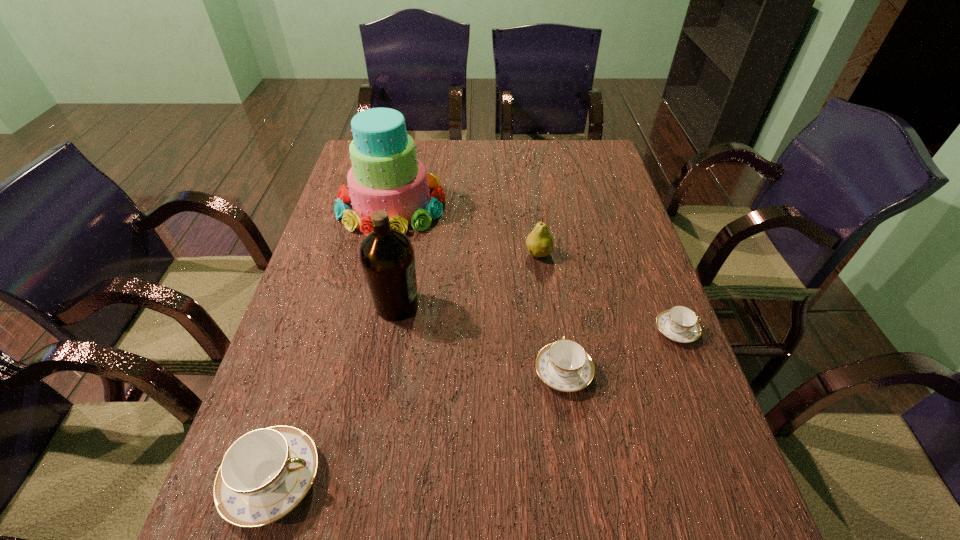
The image size is (960, 540). What are the coordinates of `the second closest teacup to the olive oil` in the screenshot? It's located at (565, 366).